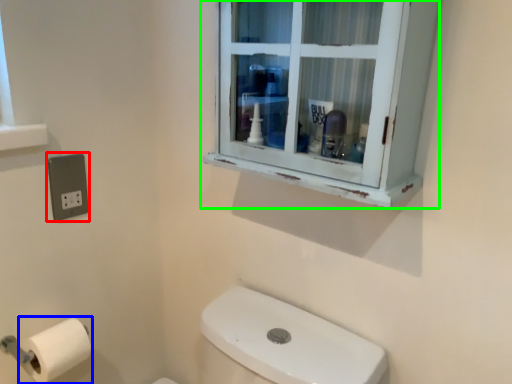
Question: Considering the real-world distances, which object is farthest from electric outlet (highlighted by a red box)? toilet paper (highlighted by a blue box) or window (highlighted by a green box)?

Choices:
 (A) toilet paper
 (B) window

Answer: (B)